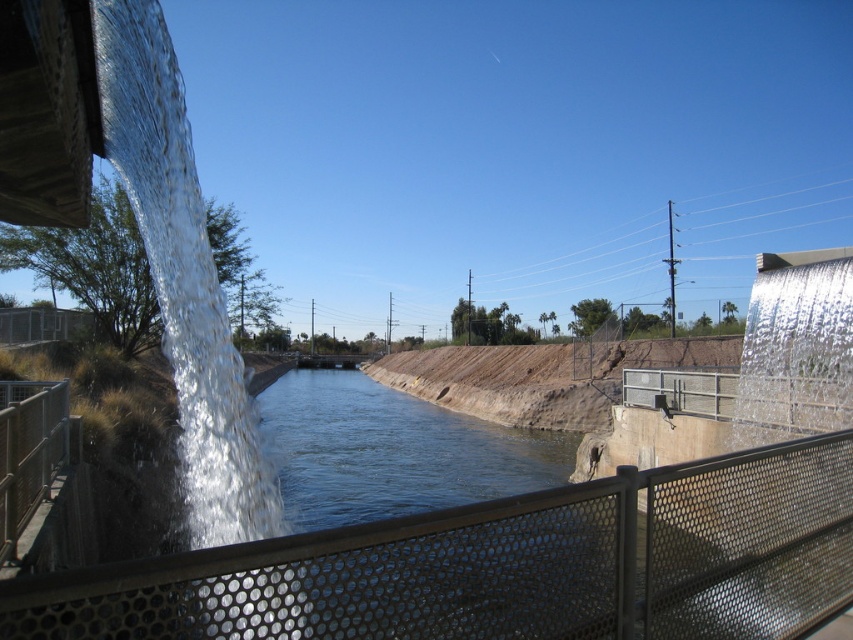
Question: Can you confirm if metal mesh fence at center is thinner than metal mesh fence at left?

Choices:
 (A) no
 (B) yes

Answer: (A)

Question: Which object appears farthest from the camera in this image?

Choices:
 (A) metal mesh fence at center
 (B) metal mesh fence at left

Answer: (B)

Question: Is metal mesh fence at center closer to the viewer compared to metal mesh fence at left?

Choices:
 (A) no
 (B) yes

Answer: (B)

Question: Which object is closer to the camera taking this photo?

Choices:
 (A) metal mesh fence at left
 (B) metal mesh fence at center

Answer: (B)

Question: From the image, what is the correct spatial relationship of metal mesh fence at center in relation to metal mesh fence at left?

Choices:
 (A) right
 (B) left

Answer: (A)